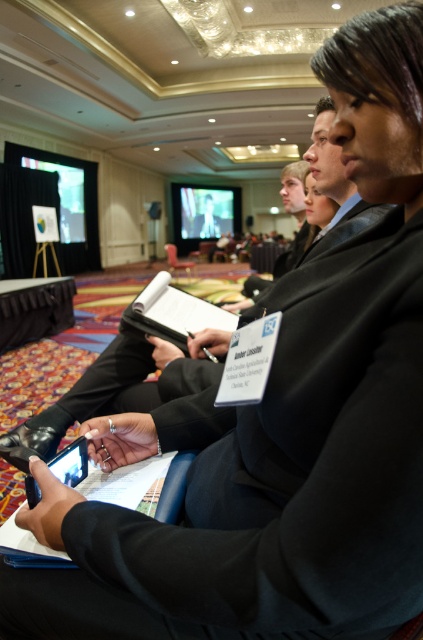
Question: Which point is closer to the camera taking this photo?

Choices:
 (A) (170, 256)
 (B) (202, 200)

Answer: (A)

Question: Can you confirm if black matte tablet computer at lower left is positioned below wooden chair at center?

Choices:
 (A) yes
 (B) no

Answer: (A)

Question: Which object is the farthest from the wooden chair at center?

Choices:
 (A) black matte tablet computer at lower left
 (B) smooth skin man at center

Answer: (A)

Question: Is smooth skin man at center thinner than wooden chair at center?

Choices:
 (A) yes
 (B) no

Answer: (B)

Question: Which point appears closest to the camera in this image?

Choices:
 (A) (27, 497)
 (B) (200, 204)
 (C) (191, 266)

Answer: (A)

Question: In this image, where is black matte tablet computer at lower left located relative to smooth skin man at center?

Choices:
 (A) left
 (B) right

Answer: (B)